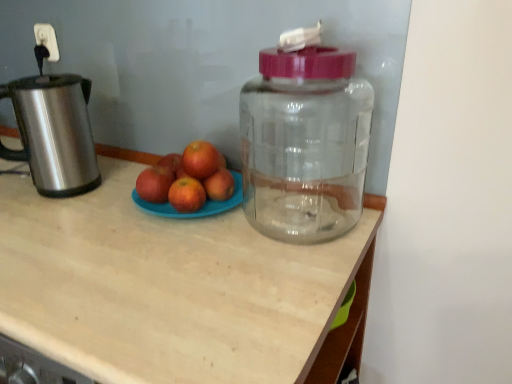
In order to click on free location in front of brushed metal kettle at left in this screenshot , I will do `click(53, 228)`.